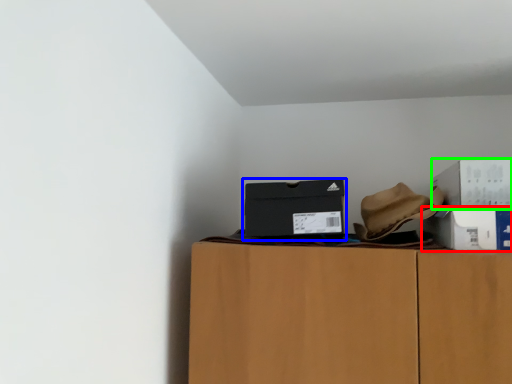
Question: Which object is the farthest from box (highlighted by a red box)? Choose among these: box (highlighted by a blue box) or box (highlighted by a green box).

Choices:
 (A) box
 (B) box

Answer: (A)